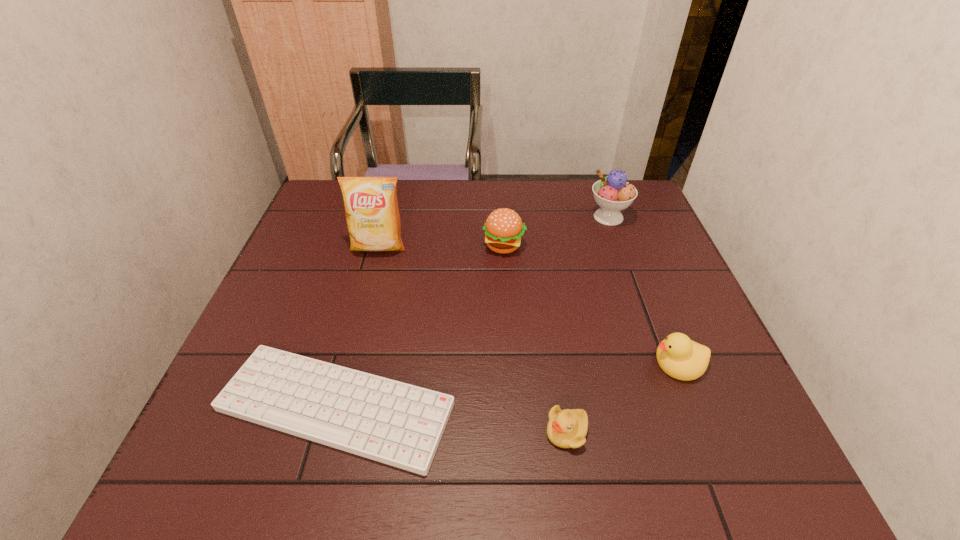
The height and width of the screenshot is (540, 960). Find the location of `the tallest object`. the tallest object is located at coordinates (371, 207).

In order to click on icecream in this screenshot , I will do [x=612, y=193].

In order to click on the fifth shortest object in this screenshot , I will do `click(612, 193)`.

You are a GUI agent. You are given a task and a screenshot of the screen. Output one action in this format:
    pyautogui.click(x=<x>, y=<y>)
    Task: Click on the hamburger
    The width and height of the screenshot is (960, 540).
    Given the screenshot: What is the action you would take?
    pyautogui.click(x=504, y=229)

This screenshot has height=540, width=960. Find the location of `the farther duckling`. the farther duckling is located at coordinates (681, 358).

Image resolution: width=960 pixels, height=540 pixels. In order to click on the right duckling in this screenshot , I will do `click(681, 358)`.

This screenshot has height=540, width=960. I want to click on the nearer duckling, so click(x=567, y=428).

Image resolution: width=960 pixels, height=540 pixels. I want to click on the left duckling, so click(x=567, y=428).

Image resolution: width=960 pixels, height=540 pixels. Identify the location of the shortest object. pyautogui.click(x=395, y=423).

The width and height of the screenshot is (960, 540). I want to click on free space located 0.360m on the front-facing side of the crisp (potato chip), so click(x=347, y=369).